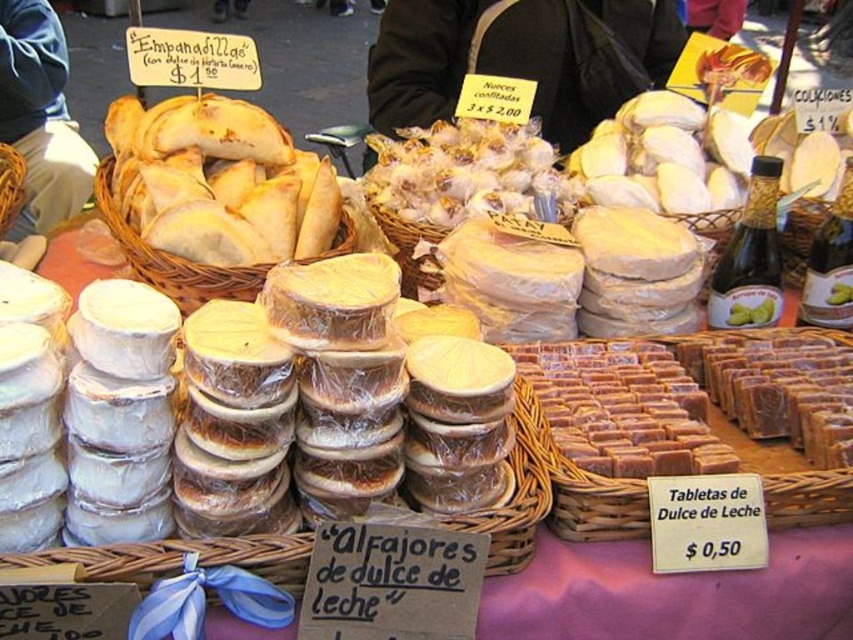
You are a customer at the market stall and want to buy some items. You see the purple fabric at lower center and the white plastic containers at center. Which item is placed on top of the other?

The white plastic containers at center are placed on top of the purple fabric at lower center because the purple fabric is positioned under them.

You are a customer at the market stall. You need to choose between the translucent plastic garlic at center and the white plastic containers at center to pack your cookies. Which one can hold more cookies based on their sizes?

The white plastic containers at center can hold more cookies because their width is greater than the translucent plastic garlic at center.

You are a customer at the market stall and want to buy both the brown woven basket at center and the purple fabric at lower center. However, you have a small backpack with limited space. Based on their sizes, which item should you prioritize purchasing if you can only carry one?

The brown woven basket at center is bigger than the purple fabric at lower center, so you should prioritize purchasing the purple fabric at lower center if you can only carry one item due to space constraints.